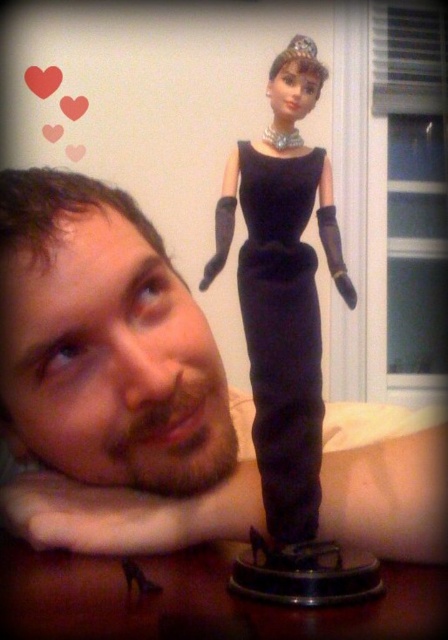
Is matte black doll at upper center to the right of black velvet dress at center from the viewer's perspective?

No, matte black doll at upper center is not to the right of black velvet dress at center.

Does point (84, 324) lie in front of point (258, 337)?

No.

Which is in front, point (47, 308) or point (314, 276)?

Positioned in front is point (314, 276).

Locate an element on the screen. The height and width of the screenshot is (640, 448). matte black doll at upper center is located at coordinates (110, 380).

Does matte black dress at center have a greater height compared to black velvet dress at center?

Yes.

The width and height of the screenshot is (448, 640). What do you see at coordinates (284, 292) in the screenshot? I see `matte black dress at center` at bounding box center [284, 292].

Between point (314, 77) and point (271, 400), which one is positioned in front?

Positioned in front is point (271, 400).

The width and height of the screenshot is (448, 640). I want to click on matte black dress at center, so click(284, 292).

Who is more distant from viewer, [132,364] or [305,387]?

The point [132,364] is more distant.

Does point (235, 460) come closer to viewer compared to point (301, 364)?

That is False.

The height and width of the screenshot is (640, 448). I want to click on matte black doll at upper center, so click(x=110, y=380).